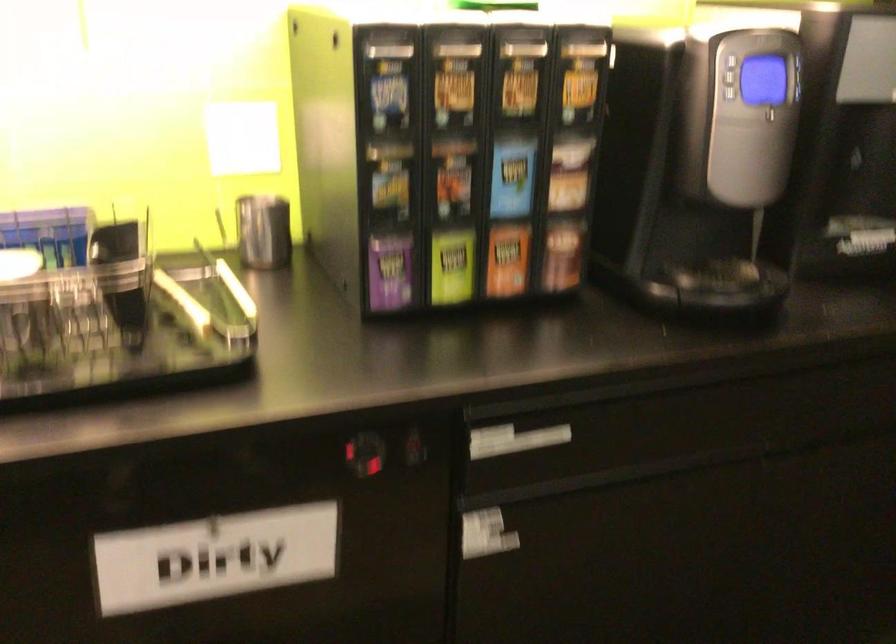
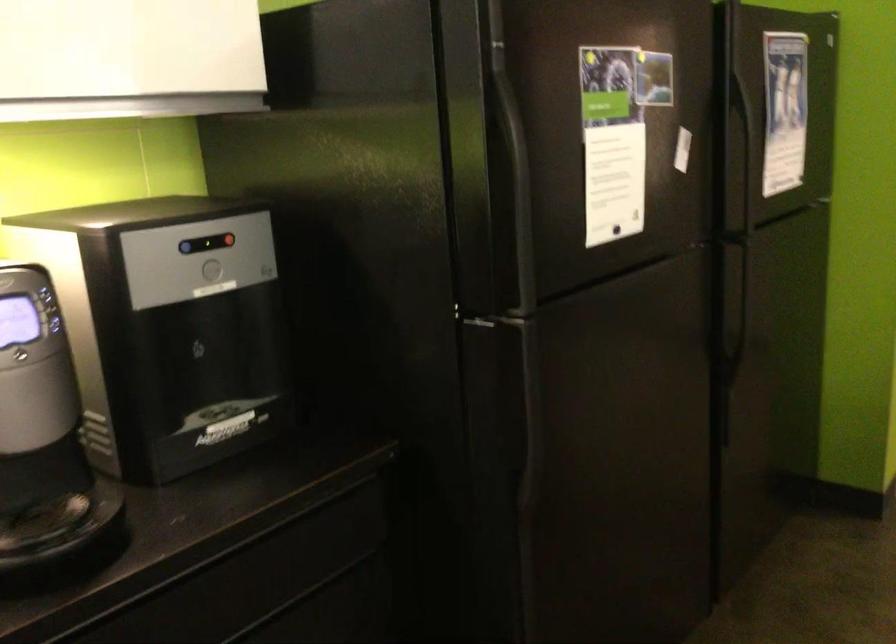
Question: Based on the continuous images, in which direction is the camera rotating? Reply with the corresponding letter.

Choices:
 (A) Left
 (B) Right
 (C) Up
 (D) Down

Answer: (B)